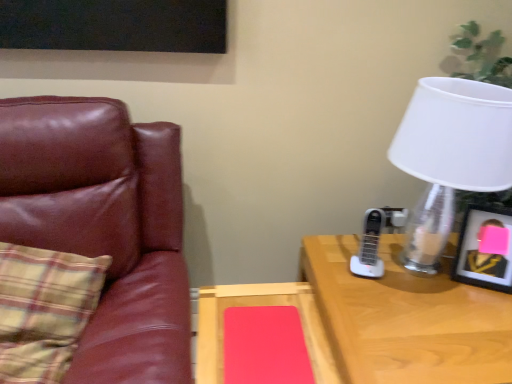
This screenshot has height=384, width=512. I want to click on vacant point above matte wood table at center (from a real-world perspective), so click(x=264, y=326).